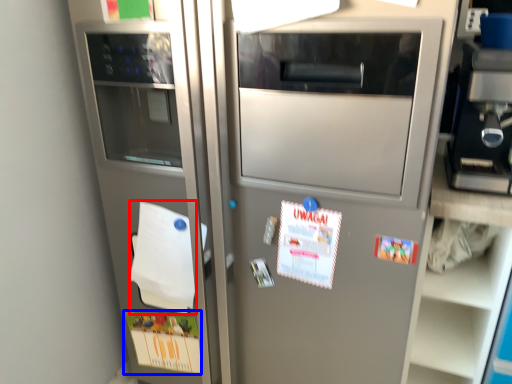
Question: Which object is further to the camera taking this photo, notepad (highlighted by a red box) or postcard (highlighted by a blue box)?

Choices:
 (A) notepad
 (B) postcard

Answer: (B)